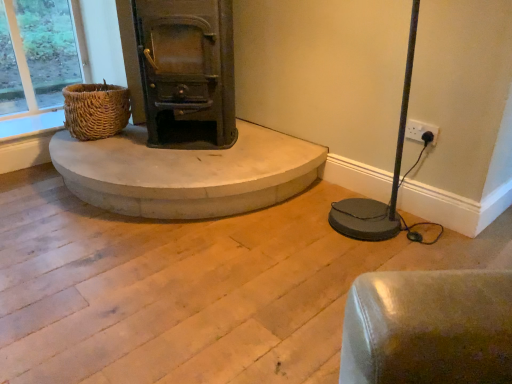
Question: Is smooth concrete hearth at center inside or outside of woven brown basket at left?

Choices:
 (A) outside
 (B) inside

Answer: (A)

Question: From the image's perspective, is smooth concrete hearth at center located above or below woven brown basket at left?

Choices:
 (A) below
 (B) above

Answer: (A)

Question: Considering the positions of smooth concrete hearth at center and woven brown basket at left in the image, is smooth concrete hearth at center taller or shorter than woven brown basket at left?

Choices:
 (A) tall
 (B) short

Answer: (B)

Question: Considering the positions of point (98, 110) and point (200, 213), is point (98, 110) closer or farther from the camera than point (200, 213)?

Choices:
 (A) farther
 (B) closer

Answer: (A)

Question: Is woven brown basket at left taller or shorter than smooth concrete hearth at center?

Choices:
 (A) short
 (B) tall

Answer: (B)

Question: From the image's perspective, is woven brown basket at left located above or below smooth concrete hearth at center?

Choices:
 (A) below
 (B) above

Answer: (B)

Question: In terms of width, does woven brown basket at left look wider or thinner when compared to smooth concrete hearth at center?

Choices:
 (A) thin
 (B) wide

Answer: (A)